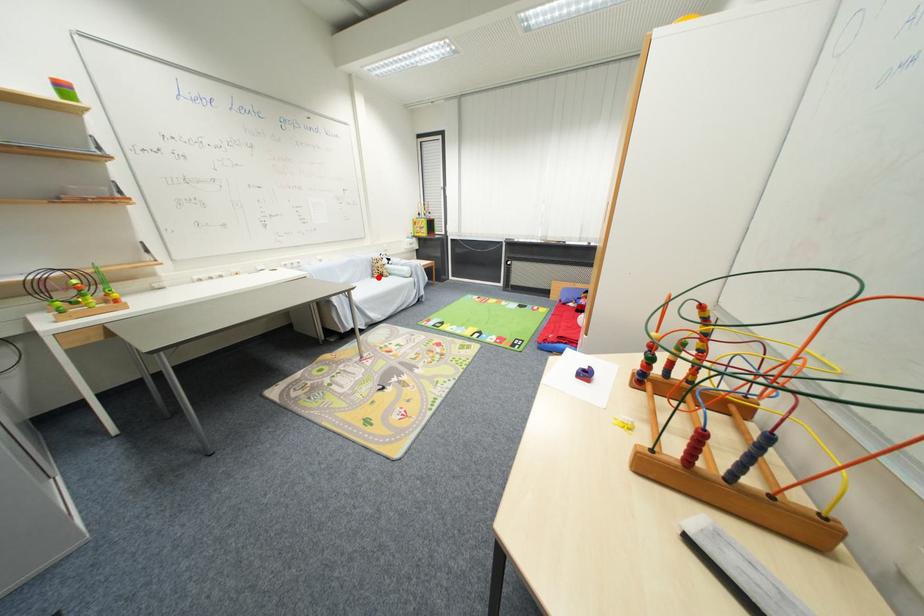
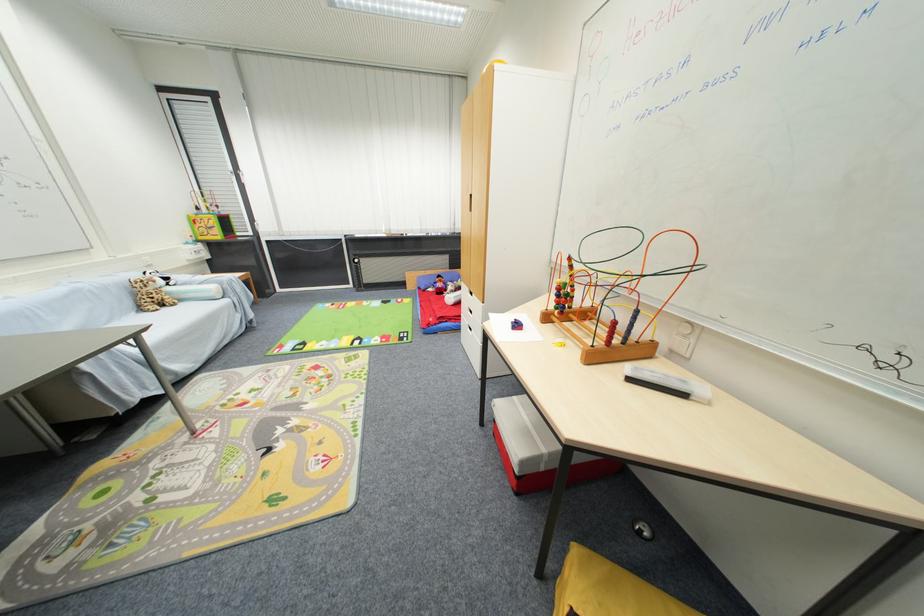
Question: I am providing you with two images of the same scene from different viewpoints. A red point is shown in image1. For the corresponding object point in image2, is it positioned nearer or farther from the camera?

Choices:
 (A) Nearer
 (B) Farther

Answer: (B)